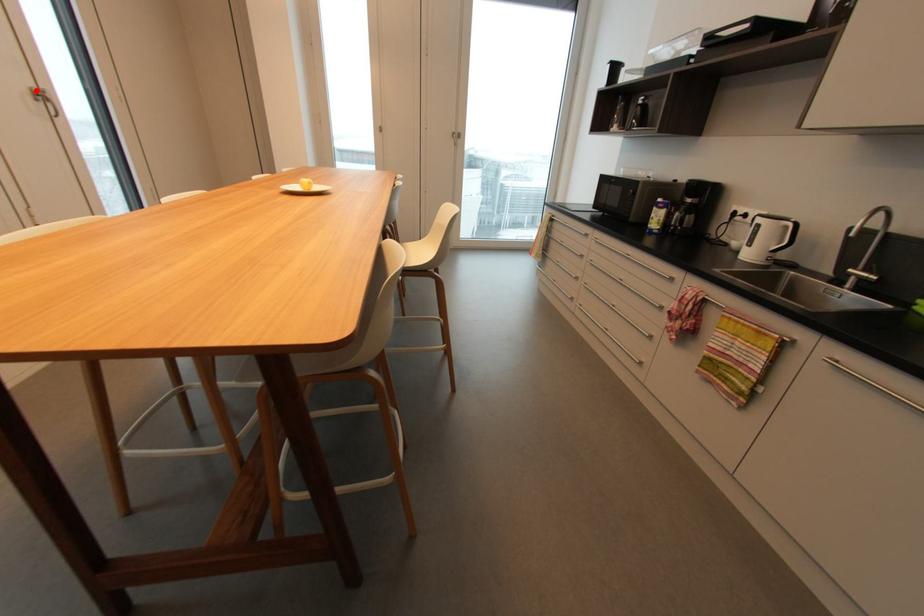
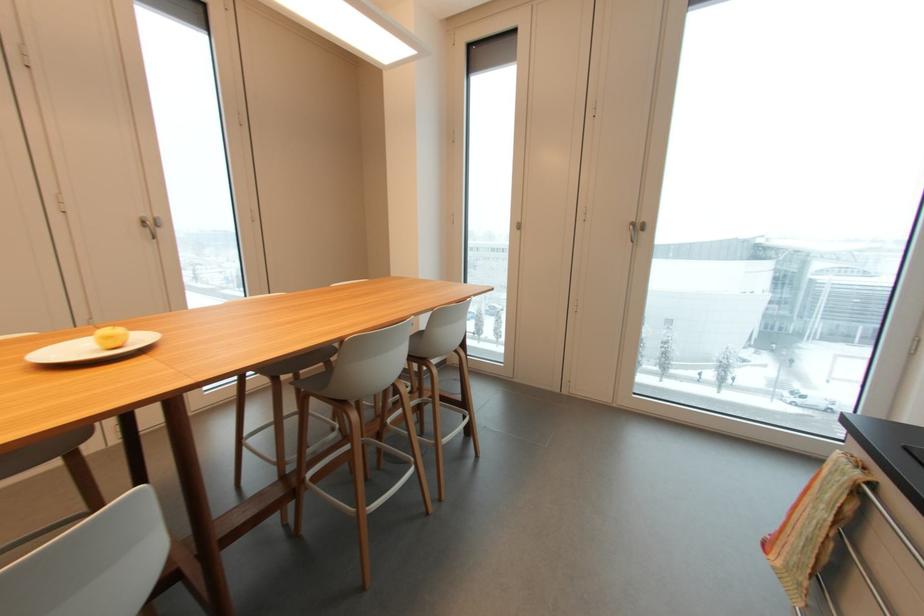
In the second image, find the point that corresponds to the highlighted location in the first image.

(143, 217)